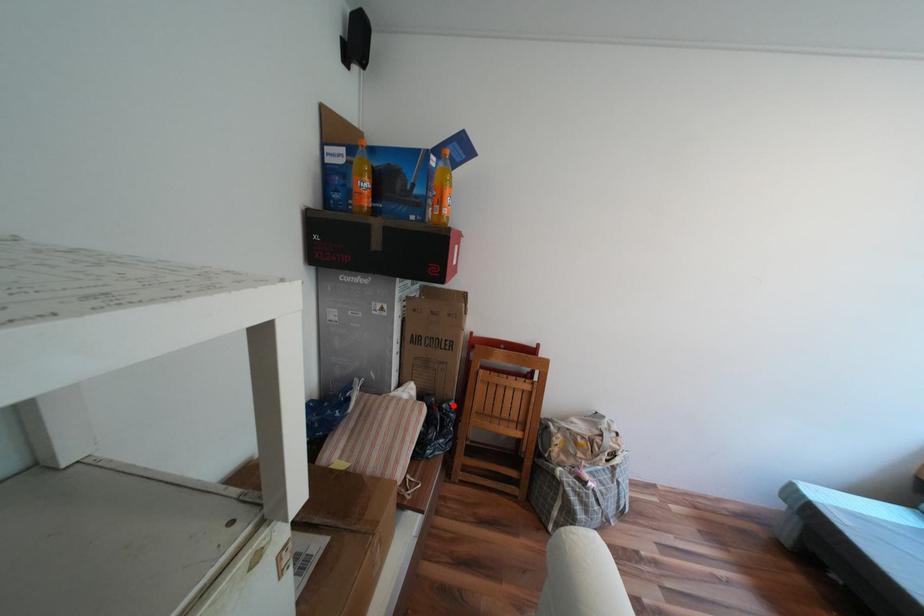
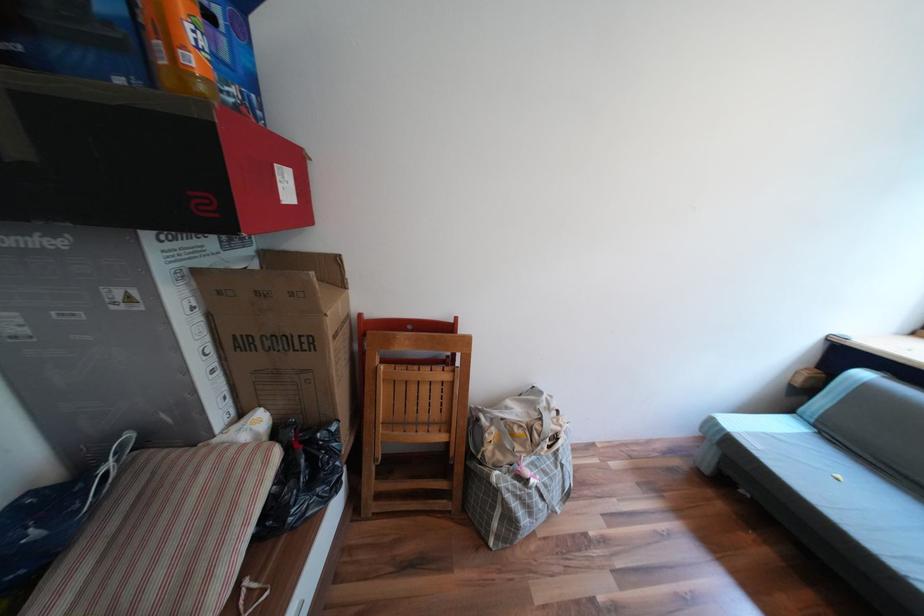
Question: A red point is marked in image1. In image2, is the corresponding 3D point closer to the camera or farther? Reply with the corresponding letter.

Choices:
 (A) The corresponding 3D point is closer.
 (B) The corresponding 3D point is farther.

Answer: (A)